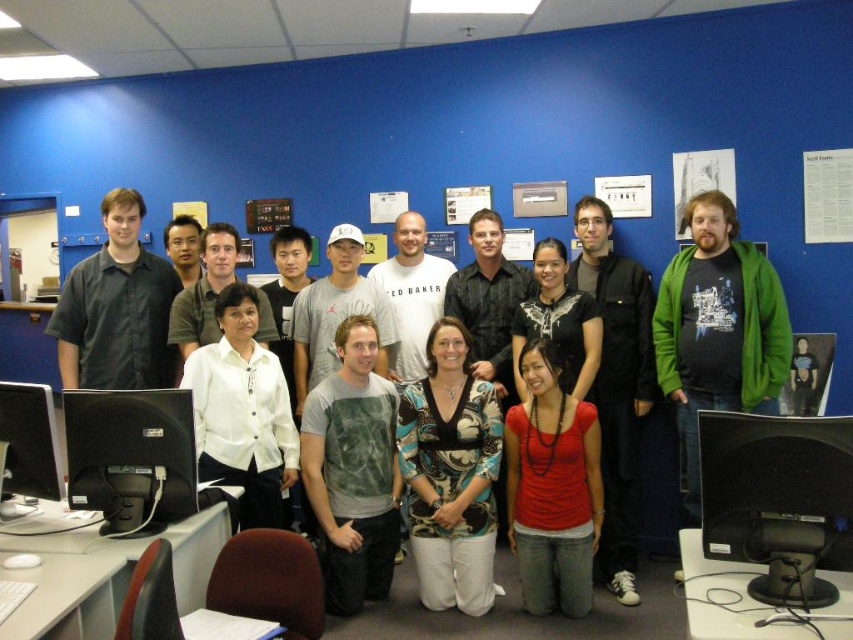
Question: Which point is farther to the camera?

Choices:
 (A) (280, 218)
 (B) (105, 524)

Answer: (A)

Question: Can you confirm if patterned fabric blouse at center is wider than black glossy monitor at lower left?

Choices:
 (A) yes
 (B) no

Answer: (A)

Question: Is matte black jacket at center wider than matte black shirt at left?

Choices:
 (A) yes
 (B) no

Answer: (B)

Question: Is red matte shirt at center behind matte black jacket at center?

Choices:
 (A) yes
 (B) no

Answer: (B)

Question: Which is farther from the wooden bulletin board at center?

Choices:
 (A) patterned fabric blouse at center
 (B) red matte shirt at center

Answer: (B)

Question: Which of the following is the farthest from the observer?

Choices:
 (A) red matte shirt at center
 (B) matte black jacket at center
 (C) black glossy monitor at left
 (D) white matte shirt at center

Answer: (B)